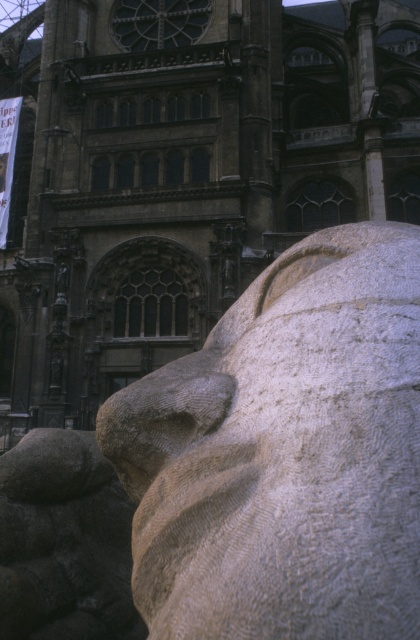
Question: Does dark stone church at center appear over white stone lion at center?

Choices:
 (A) yes
 (B) no

Answer: (A)

Question: Can you confirm if dark stone church at center is positioned to the right of white stone lion at center?

Choices:
 (A) yes
 (B) no

Answer: (B)

Question: Is dark stone church at center to the right of white stone lion at center from the viewer's perspective?

Choices:
 (A) no
 (B) yes

Answer: (A)